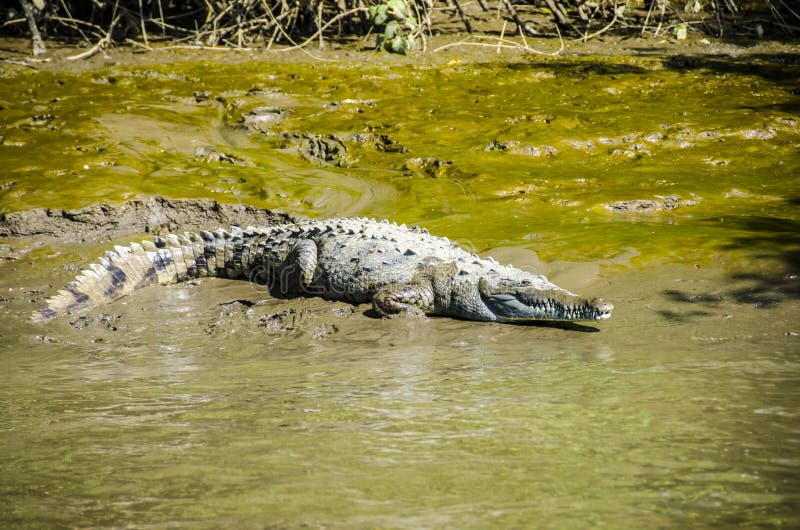
Locate an element on the screen. The height and width of the screenshot is (530, 800). plant is located at coordinates (404, 41), (297, 40), (101, 51), (616, 26), (492, 29).